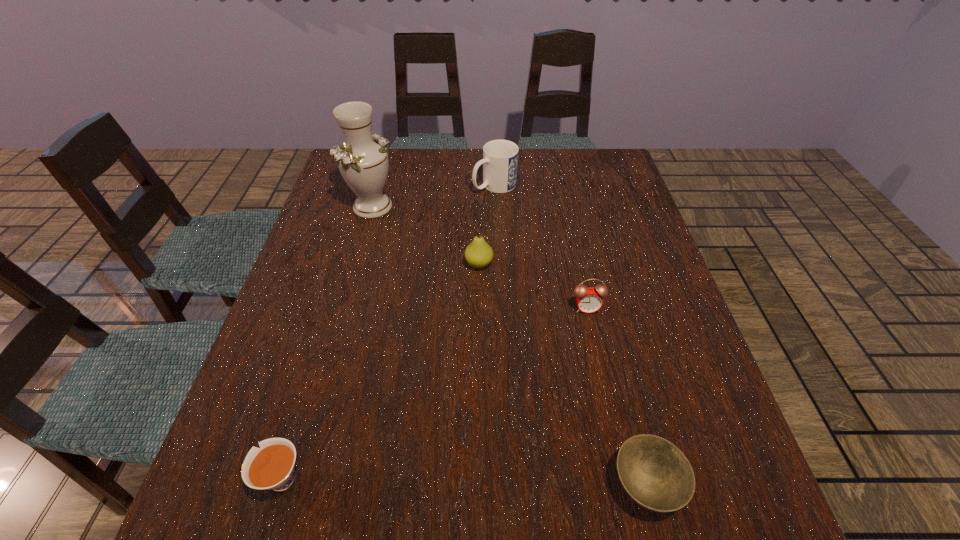
Image resolution: width=960 pixels, height=540 pixels. Find the location of `object situated at the near left corner`. object situated at the near left corner is located at coordinates (271, 467).

At what (x,y) coordinates should I click in order to perform the action: click on object that is at the near right corner. Please return your answer as a coordinate pair (x, y). Image resolution: width=960 pixels, height=540 pixels. Looking at the image, I should click on (654, 472).

This screenshot has width=960, height=540. In the image, there is a desktop. Identify the location of blank space at the far edge. (521, 158).

Image resolution: width=960 pixels, height=540 pixels. In order to click on vacant space at the left edge of the desktop in this screenshot , I will do `click(343, 233)`.

Image resolution: width=960 pixels, height=540 pixels. In the image, there is a desktop. What are the coordinates of `vacant region at the right edge` in the screenshot? It's located at (715, 472).

You are a GUI agent. You are given a task and a screenshot of the screen. Output one action in this format:
    pyautogui.click(x=<x>, y=<y>)
    Task: Click on the free space at the near right corner of the desktop
    The width and height of the screenshot is (960, 540).
    Given the screenshot: What is the action you would take?
    pyautogui.click(x=740, y=511)

Locate an element on the screen. free space between the fourth tallest object and the fourth nearest object is located at coordinates (533, 286).

You are a GUI agent. You are given a task and a screenshot of the screen. Output one action in this format:
    pyautogui.click(x=<x>, y=<y>)
    Task: Click on the vacant point located between the teacup and the mug
    The width and height of the screenshot is (960, 540).
    Given the screenshot: What is the action you would take?
    pyautogui.click(x=387, y=332)

Where is `free space between the vase and the mug`? This screenshot has width=960, height=540. free space between the vase and the mug is located at coordinates click(434, 196).

Find the location of `free area in between the mug and the bowl`. free area in between the mug and the bowl is located at coordinates (570, 335).